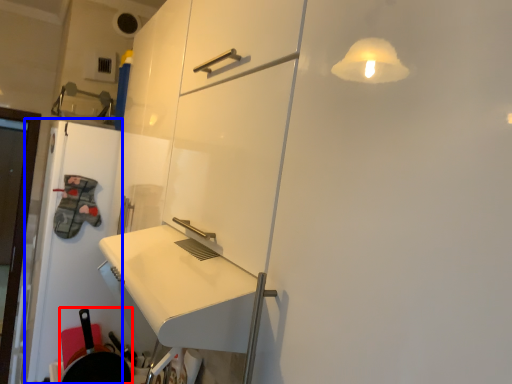
Question: Which object is closer to the camera taking this photo, frying pan (highlighted by a red box) or door (highlighted by a blue box)?

Choices:
 (A) frying pan
 (B) door

Answer: (A)